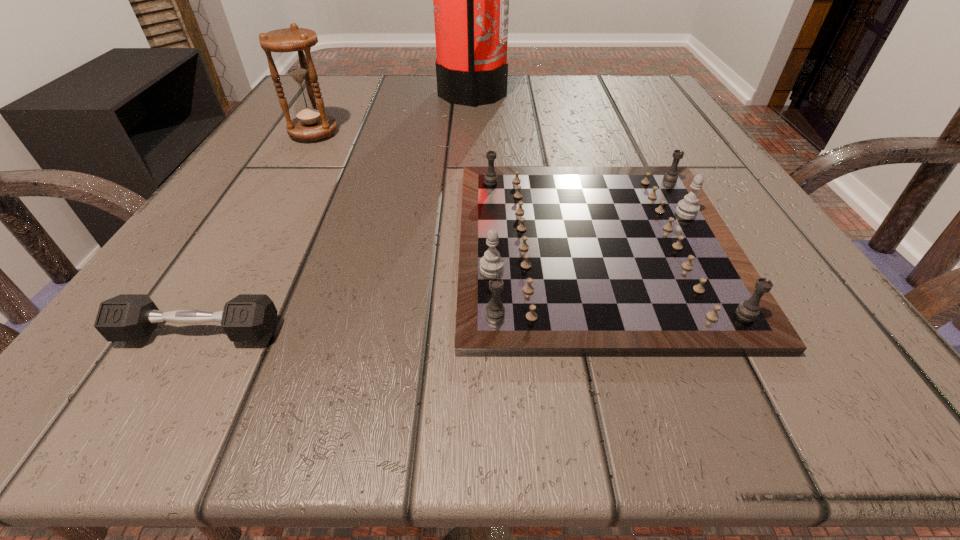
I want to click on free space that satisfies the following two spatial constraints: 1. on the board of the second shortest object; 2. on the front side of the shortest object, so click(x=620, y=332).